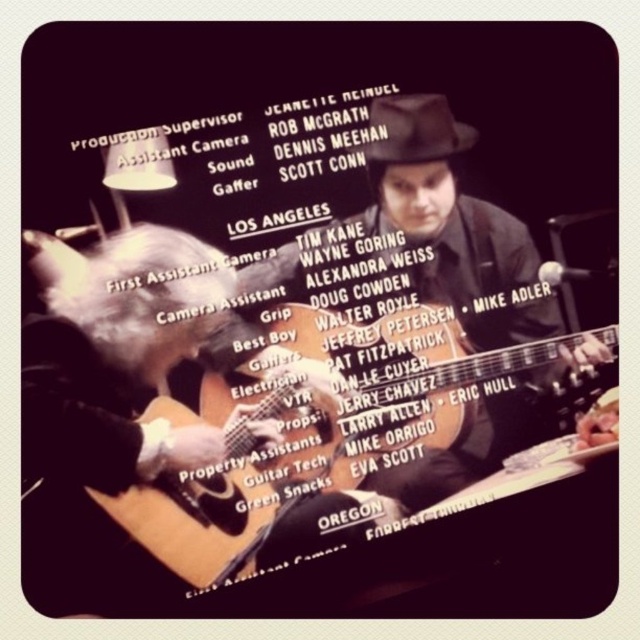
You are a photographer trying to capture a clear shot of the acoustic wood guitar at center without the matte black guitar at center blocking it. Based on the scene, can you adjust your position to achieve this?

The acoustic wood guitar at center is behind the matte black guitar at center, so moving your position to the side might allow you to see around the matte black guitar at center and capture the acoustic wood guitar at center clearly.

You are a photographer trying to capture the guitarist in the scene. Since the matte black guitar at center and the acoustic wood guitar at center are both in the frame, which guitar is closer to the camera?

The matte black guitar at center is positioned over the acoustic wood guitar at center, so the matte black guitar at center is closer to the camera.